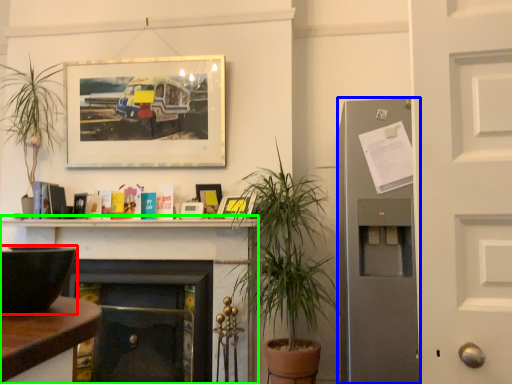
Question: Based on their relative distances, which object is nearer to appliance (highlighted by a red box)? Choose from fireplace (highlighted by a blue box) and fireplace (highlighted by a green box).

Choices:
 (A) fireplace
 (B) fireplace

Answer: (A)